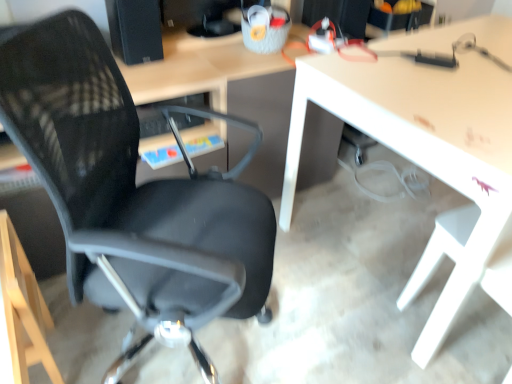
Question: In terms of height, does black mesh chair at left look taller or shorter compared to black matte speaker at upper left?

Choices:
 (A) tall
 (B) short

Answer: (A)

Question: Looking at the image, does black mesh chair at left seem bigger or smaller compared to black matte speaker at upper left?

Choices:
 (A) small
 (B) big

Answer: (B)

Question: Which object is the farthest from the black mesh chair at left?

Choices:
 (A) white glossy table at center
 (B) black matte speaker at upper left

Answer: (B)

Question: Which is nearer to the black mesh chair at left?

Choices:
 (A) black matte speaker at upper left
 (B) white glossy table at center

Answer: (B)